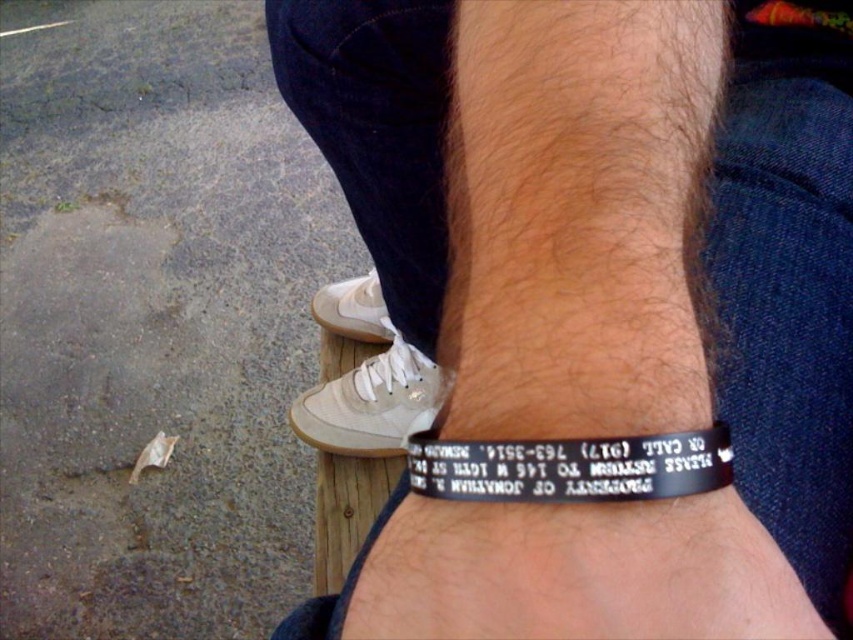
Question: Is black rubber bracelet at center wider than white leather shoe at lower center?

Choices:
 (A) no
 (B) yes

Answer: (B)

Question: Among these objects, which one is farthest from the camera?

Choices:
 (A) light beige suede shoe at lower center
 (B) white leather shoe at lower center
 (C) black rubber bracelet at center
 (D) black rubber bracelet at lower center

Answer: (B)

Question: Among these objects, which one is nearest to the camera?

Choices:
 (A) white leather shoe at lower center
 (B) black rubber bracelet at center
 (C) black rubber bracelet at lower center

Answer: (B)

Question: Which object is closer to the camera taking this photo?

Choices:
 (A) white leather shoe at lower center
 (B) light beige suede shoe at lower center
 (C) black rubber bracelet at center
 (D) black rubber bracelet at lower center

Answer: (C)

Question: Does black rubber bracelet at center have a greater width compared to light beige suede shoe at lower center?

Choices:
 (A) no
 (B) yes

Answer: (B)

Question: Does black rubber bracelet at center have a larger size compared to white leather shoe at lower center?

Choices:
 (A) yes
 (B) no

Answer: (A)